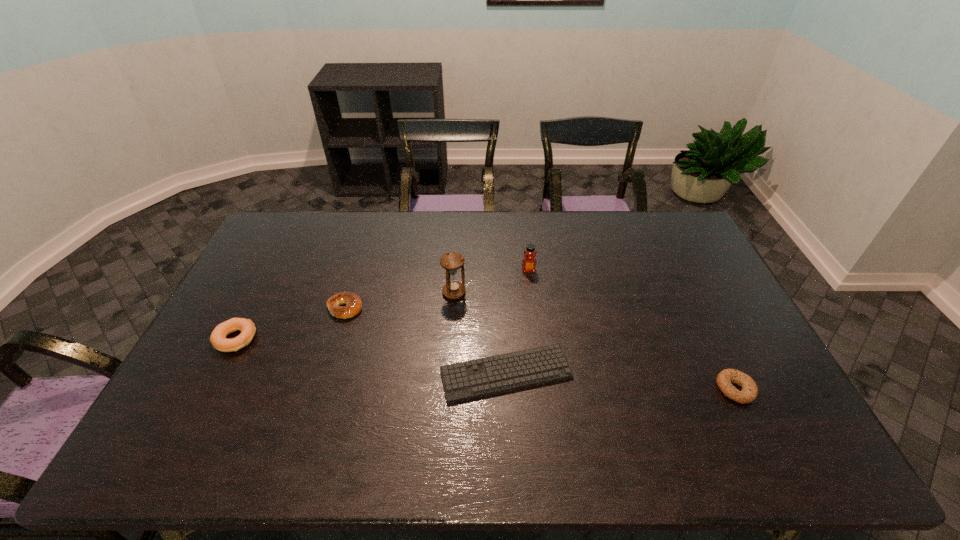
Find the location of a particular element. The width and height of the screenshot is (960, 540). hourglass is located at coordinates (451, 261).

Image resolution: width=960 pixels, height=540 pixels. I want to click on honey, so click(529, 262).

At what (x,y) coordinates should I click in order to perform the action: click on the farthest object. Please return your answer as a coordinate pair (x, y). Image resolution: width=960 pixels, height=540 pixels. Looking at the image, I should click on (529, 262).

Image resolution: width=960 pixels, height=540 pixels. In order to click on the second farthest bagel in this screenshot , I will do `click(218, 336)`.

This screenshot has width=960, height=540. Identify the location of the fourth shortest object. (218, 336).

Find the location of a particular element. the second object from left to right is located at coordinates (353, 303).

This screenshot has height=540, width=960. What are the coordinates of `the farthest bagel` in the screenshot? It's located at (353, 303).

Locate an element on the screen. The height and width of the screenshot is (540, 960). the rightmost object is located at coordinates (749, 391).

At what (x,y) coordinates should I click in order to perform the action: click on the rightmost bagel. Please return your answer as a coordinate pair (x, y). The height and width of the screenshot is (540, 960). Looking at the image, I should click on (749, 391).

Where is `the shortest object`? The height and width of the screenshot is (540, 960). the shortest object is located at coordinates (486, 376).